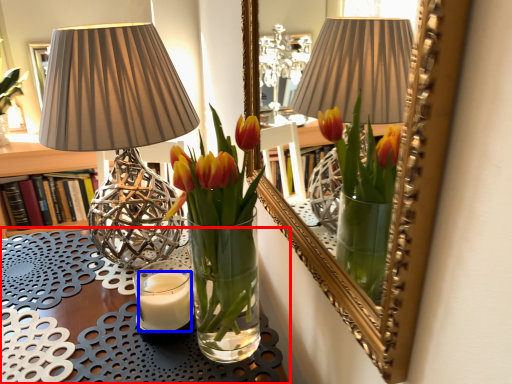
Question: Which of the following is the farthest to the observer, table (highlighted by a red box) or candle (highlighted by a blue box)?

Choices:
 (A) table
 (B) candle

Answer: (B)